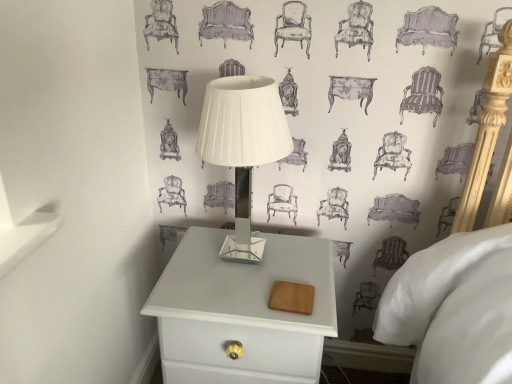
Question: Considering the positions of white matte nightstand at lower center and white glossy table lamp at center in the image, is white matte nightstand at lower center wider or thinner than white glossy table lamp at center?

Choices:
 (A) wide
 (B) thin

Answer: (A)

Question: Considering the positions of point click(x=276, y=364) and point click(x=280, y=129), is point click(x=276, y=364) closer or farther from the camera than point click(x=280, y=129)?

Choices:
 (A) closer
 (B) farther

Answer: (B)

Question: Is white matte nightstand at lower center inside or outside of white glossy table lamp at center?

Choices:
 (A) outside
 (B) inside

Answer: (A)

Question: Which is correct: white glossy table lamp at center is inside white matte nightstand at lower center, or outside of it?

Choices:
 (A) inside
 (B) outside

Answer: (B)

Question: From the image's perspective, is white glossy table lamp at center located above or below white matte nightstand at lower center?

Choices:
 (A) above
 (B) below

Answer: (A)

Question: Is white glossy table lamp at center wider or thinner than white matte nightstand at lower center?

Choices:
 (A) thin
 (B) wide

Answer: (A)

Question: Relative to white matte nightstand at lower center, is white glossy table lamp at center in front or behind?

Choices:
 (A) front
 (B) behind

Answer: (A)